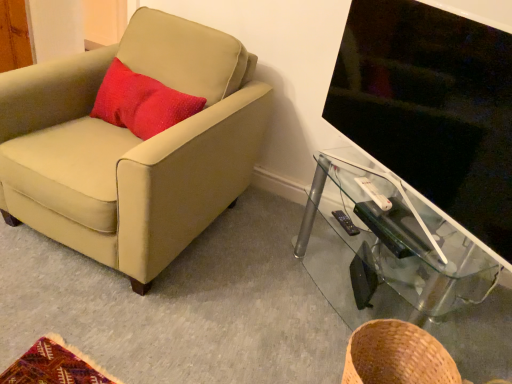
Question: Can you confirm if brown woven basket at lower right is positioned to the right of white plastic remote control at right, the second remote control ordered from the bottom?

Choices:
 (A) yes
 (B) no

Answer: (B)

Question: From a real-world perspective, is brown woven basket at lower right positioned over white plastic remote control at right, marked as the second remote control in a back-to-front arrangement, based on gravity?

Choices:
 (A) no
 (B) yes

Answer: (A)

Question: Is brown woven basket at lower right oriented towards white plastic remote control at right, positioned as the first remote control in top-to-bottom order?

Choices:
 (A) yes
 (B) no

Answer: (B)

Question: From a real-world perspective, is brown woven basket at lower right beneath white plastic remote control at right, the second remote control ordered from the bottom?

Choices:
 (A) no
 (B) yes

Answer: (B)

Question: From the image's perspective, is brown woven basket at lower right over white plastic remote control at right, positioned as the first remote control in top-to-bottom order?

Choices:
 (A) no
 (B) yes

Answer: (A)

Question: In terms of size, does black glossy tv at right appear bigger or smaller than brown woven basket at lower right?

Choices:
 (A) big
 (B) small

Answer: (A)

Question: Do you think black glossy tv at right is within brown woven basket at lower right, or outside of it?

Choices:
 (A) outside
 (B) inside

Answer: (A)

Question: Does point (482, 223) appear closer or farther from the camera than point (410, 354)?

Choices:
 (A) closer
 (B) farther

Answer: (A)

Question: Relative to brown woven basket at lower right, is black glossy tv at right in front or behind?

Choices:
 (A) front
 (B) behind

Answer: (A)

Question: In terms of size, does black glossy tv at right appear bigger or smaller than transparent glass tv stand at right?

Choices:
 (A) big
 (B) small

Answer: (B)

Question: From a real-world perspective, is black glossy tv at right above or below transparent glass tv stand at right?

Choices:
 (A) below
 (B) above

Answer: (B)

Question: Is black glossy tv at right wider or thinner than transparent glass tv stand at right?

Choices:
 (A) wide
 (B) thin

Answer: (B)

Question: From the image's perspective, is black glossy tv at right positioned above or below transparent glass tv stand at right?

Choices:
 (A) above
 (B) below

Answer: (A)

Question: Is brown woven basket at lower right situated inside black glossy tv at right or outside?

Choices:
 (A) inside
 (B) outside

Answer: (B)

Question: Visually, is brown woven basket at lower right positioned to the left or to the right of black glossy tv at right?

Choices:
 (A) left
 (B) right

Answer: (A)